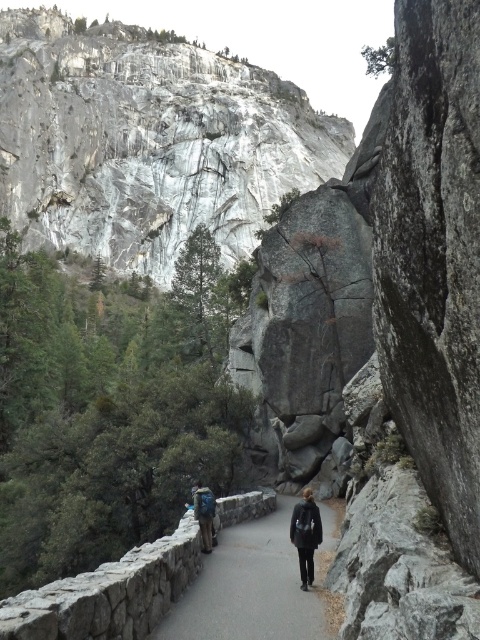
Does dark gray asphalt path at center have a lesser width compared to black matte jacket at center?

Incorrect, dark gray asphalt path at center's width is not less than black matte jacket at center's.

Which is below, dark gray asphalt path at center or black matte jacket at center?

dark gray asphalt path at center is lower down.

Who is more distant from viewer, (305, 634) or (302, 577)?

The point (302, 577) is behind.

Locate an element on the screen. dark gray asphalt path at center is located at coordinates (252, 586).

Who is taller, white marble mountain at upper center or dark gray asphalt path at center?

white marble mountain at upper center

Does white marble mountain at upper center appear under dark gray asphalt path at center?

No, white marble mountain at upper center is not below dark gray asphalt path at center.

The width and height of the screenshot is (480, 640). What do you see at coordinates (146, 141) in the screenshot?
I see `white marble mountain at upper center` at bounding box center [146, 141].

Find the location of a particular element. The image size is (480, 640). white marble mountain at upper center is located at coordinates (146, 141).

Can you confirm if black matte jacket at center is thinner than blue fabric backpack at center?

No.

The width and height of the screenshot is (480, 640). Describe the element at coordinates (305, 534) in the screenshot. I see `black matte jacket at center` at that location.

Locate an element on the screen. black matte jacket at center is located at coordinates (305, 534).